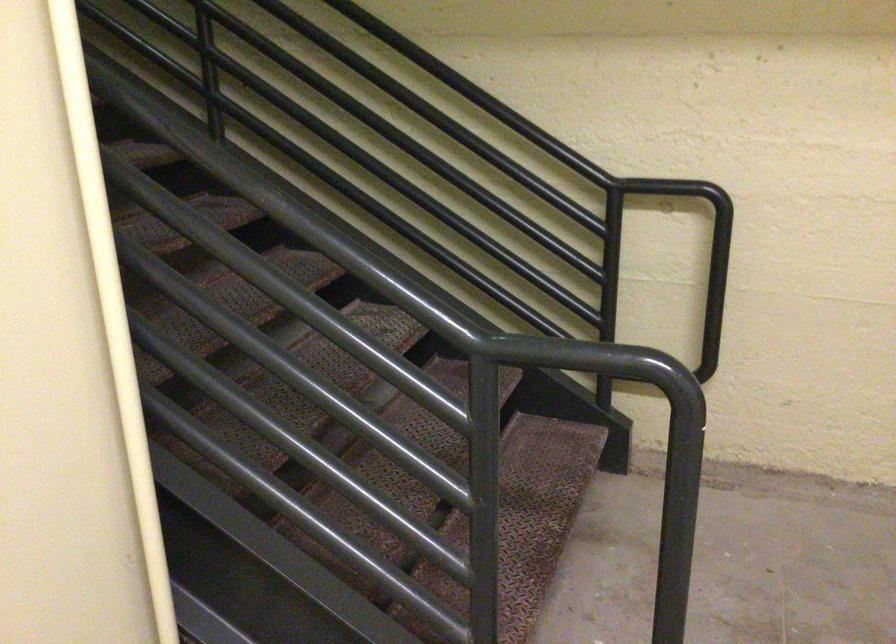
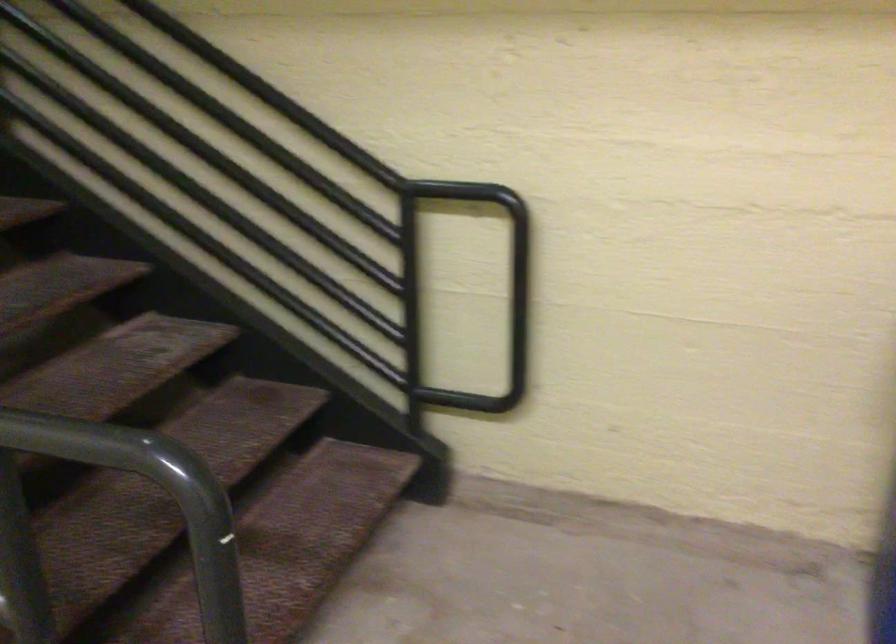
Question: The camera is either moving clockwise (left) or counter-clockwise (right) around the object. The first image is from the beginning of the video and the second image is from the end. Is the camera moving left or right when shooting the video?

Choices:
 (A) Left
 (B) Right

Answer: (A)